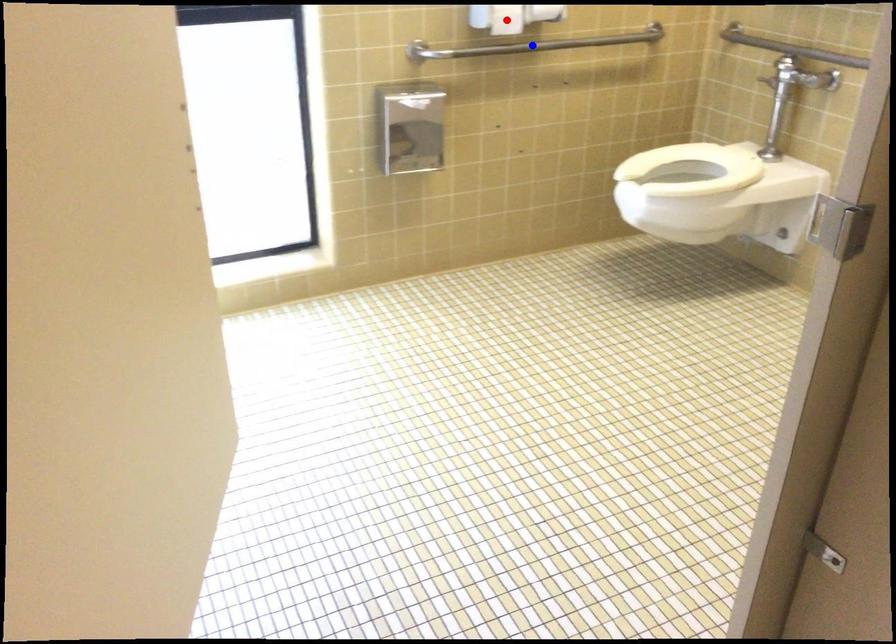
Question: In the image, two points are highlighted. Which point is nearer to the camera? Reply with the corresponding letter.

Choices:
 (A) blue point
 (B) red point

Answer: (B)